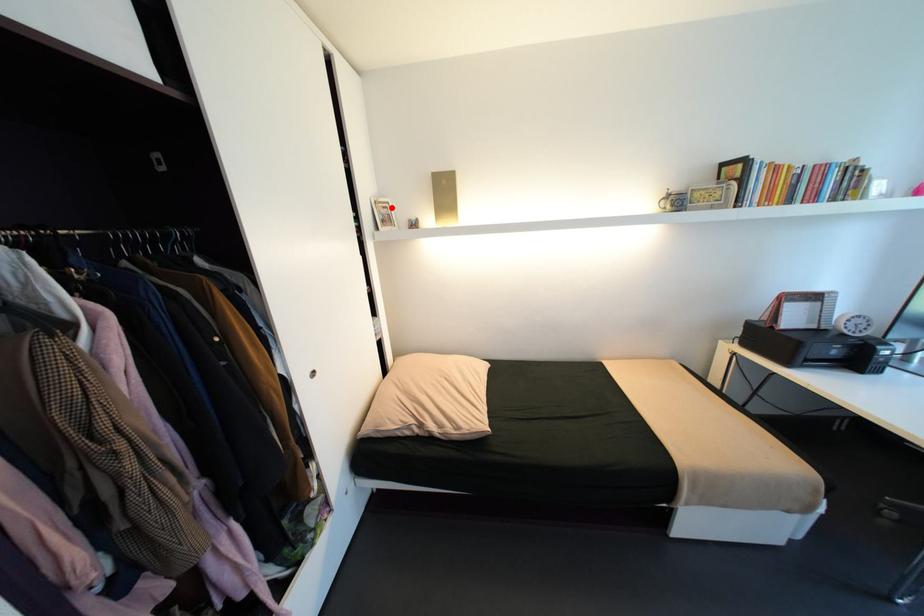
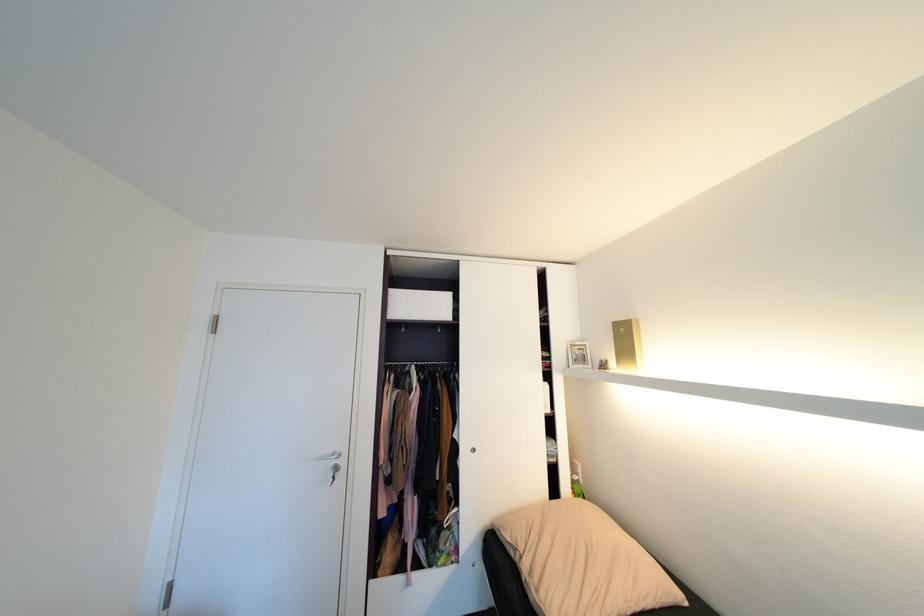
Where in the second image is the point corresponding to the highlighted location from the first image?

(587, 350)